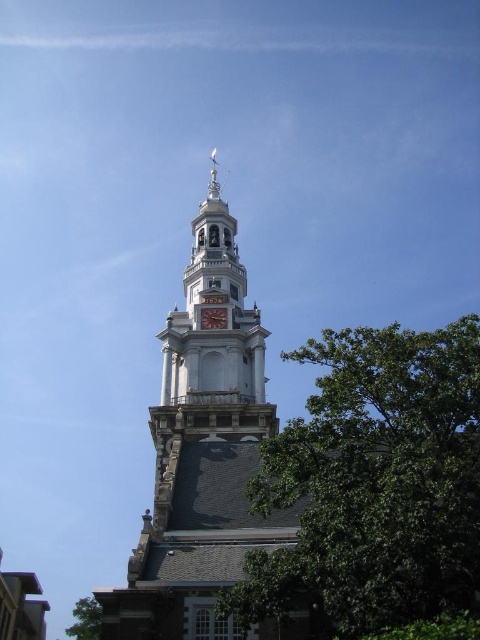
Does green leafy tree at right appear under matte gray clock at upper center?

Yes.

Does green leafy tree at right appear on the right side of matte gray clock at upper center?

Correct, you'll find green leafy tree at right to the right of matte gray clock at upper center.

Is point (469, 493) farther from viewer compared to point (205, 320)?

No, it is in front of (205, 320).

At what (x,y) coordinates should I click in order to perform the action: click on green leafy tree at right. Please return your answer as a coordinate pair (x, y). This screenshot has width=480, height=640. Looking at the image, I should click on (373, 486).

Is stone clock tower at center above matte gray clock at upper center?

Yes, stone clock tower at center is above matte gray clock at upper center.

Which of these two, stone clock tower at center or matte gray clock at upper center, stands shorter?

matte gray clock at upper center is shorter.

Identify the location of stone clock tower at center. (202, 452).

Can you confirm if green leafy tree at right is positioned to the right of stone clock tower at center?

Yes, green leafy tree at right is to the right of stone clock tower at center.

Can you confirm if green leafy tree at right is positioned above stone clock tower at center?

Actually, green leafy tree at right is below stone clock tower at center.

Between point (358, 570) and point (212, 404), which one is positioned in front?

Point (358, 570) is more forward.

You are a GUI agent. You are given a task and a screenshot of the screen. Output one action in this format:
    pyautogui.click(x=<x>, y=<y>)
    Task: Click on the green leafy tree at right
    
    Given the screenshot: What is the action you would take?
    pyautogui.click(x=373, y=486)